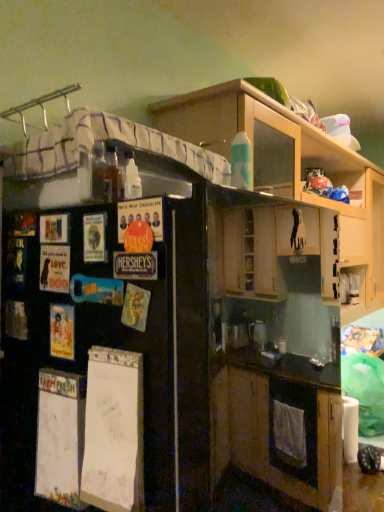
Question: Is black matte refrigerator at left further to the viewer compared to matte cardboard poster at left, the 3th poster positioned from the bottom?

Choices:
 (A) no
 (B) yes

Answer: (A)

Question: From a real-world perspective, is black matte refrigerator at left positioned under matte cardboard poster at left, which appears as the 1th poster when viewed from the front, based on gravity?

Choices:
 (A) yes
 (B) no

Answer: (A)

Question: Considering the relative sizes of black matte refrigerator at left and matte cardboard poster at left, the 3th poster positioned from the bottom, in the image provided, is black matte refrigerator at left wider than matte cardboard poster at left, the 3th poster positioned from the bottom,?

Choices:
 (A) yes
 (B) no

Answer: (A)

Question: Would you consider black matte refrigerator at left to be distant from matte cardboard poster at left, which appears as the 1th poster when viewed from the front?

Choices:
 (A) yes
 (B) no

Answer: (B)

Question: Does black matte refrigerator at left lie in front of matte cardboard poster at left, which is counted as the third poster, starting from the back?

Choices:
 (A) yes
 (B) no

Answer: (A)

Question: Which is correct: matte paper poster at left, the third poster when ordered from top to bottom, is inside matte cardboard poster at left, which is counted as the third poster, starting from the back, or outside of it?

Choices:
 (A) outside
 (B) inside

Answer: (A)

Question: Is matte paper poster at left, acting as the 2th poster starting from the back, bigger or smaller than matte cardboard poster at left, the 1th poster positioned from the top?

Choices:
 (A) big
 (B) small

Answer: (B)

Question: Is point (66, 327) positioned closer to the camera than point (160, 240)?

Choices:
 (A) farther
 (B) closer

Answer: (A)

Question: Would you say matte paper poster at left, acting as the 2th poster starting from the back, is to the left or to the right of matte cardboard poster at left, arranged as the first poster when viewed from the right, in the picture?

Choices:
 (A) right
 (B) left

Answer: (B)

Question: From their relative heights in the image, would you say matte paper poster at left, which ranks as the 2th poster in left-to-right order, is taller or shorter than black matte refrigerator at left?

Choices:
 (A) short
 (B) tall

Answer: (A)

Question: From a real-world perspective, is matte paper poster at left, the third poster when ordered from top to bottom, positioned above or below black matte refrigerator at left?

Choices:
 (A) above
 (B) below

Answer: (A)

Question: Is matte paper poster at left, which ranks as the 2th poster in left-to-right order, in front of or behind black matte refrigerator at left in the image?

Choices:
 (A) front
 (B) behind

Answer: (B)

Question: Looking at their shapes, would you say matte paper poster at left, which ranks as the 2th poster in front-to-back order, is wider or thinner than black matte refrigerator at left?

Choices:
 (A) thin
 (B) wide

Answer: (A)

Question: Is matte paper poster at left, positioned as the 2th poster in top-to-bottom order, in front of or behind wooden cabinets at upper center in the image?

Choices:
 (A) behind
 (B) front

Answer: (B)

Question: Is matte paper poster at left, the 2th poster ordered from the bottom, inside or outside of wooden cabinets at upper center?

Choices:
 (A) inside
 (B) outside

Answer: (B)